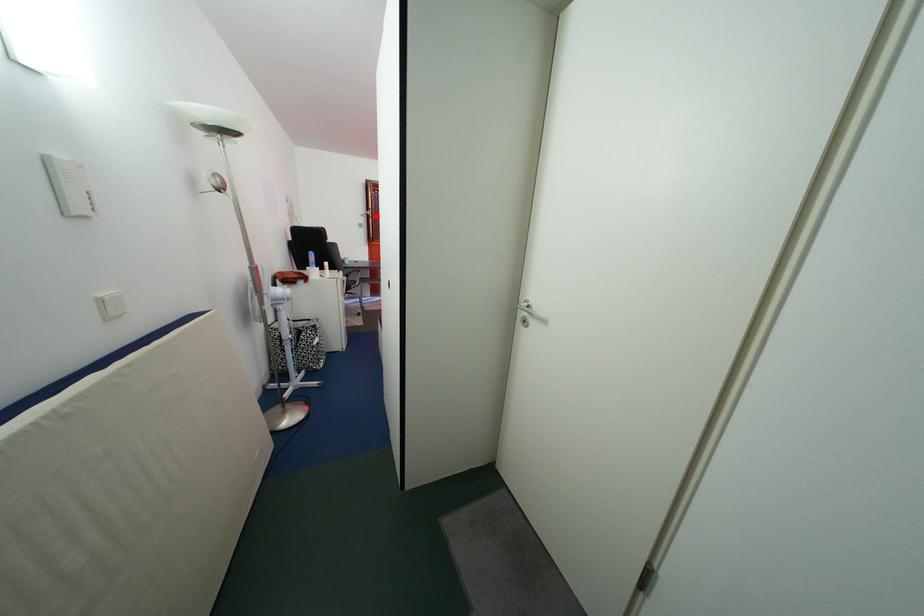
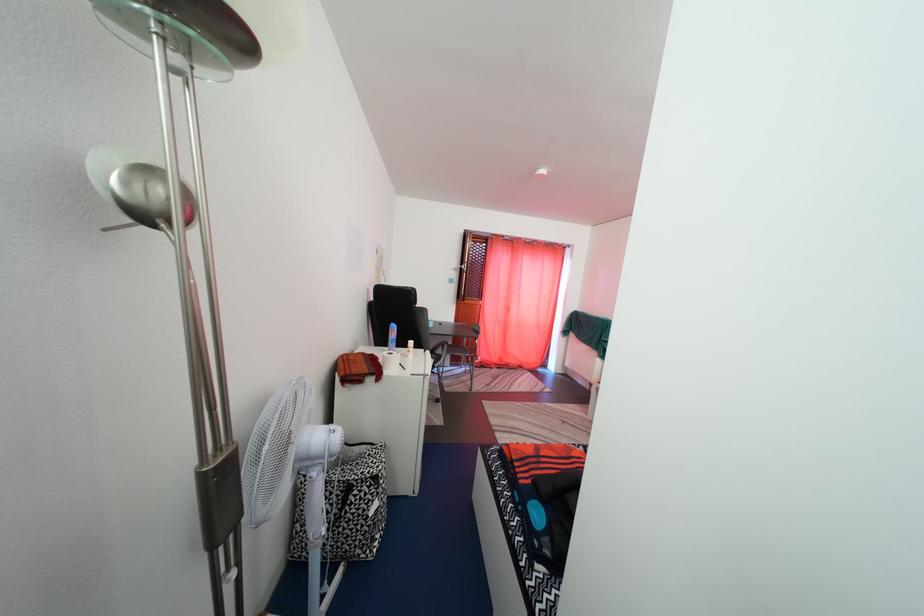
The point at the highlighted location is marked in the first image. Where is the corresponding point in the second image?

(470, 270)